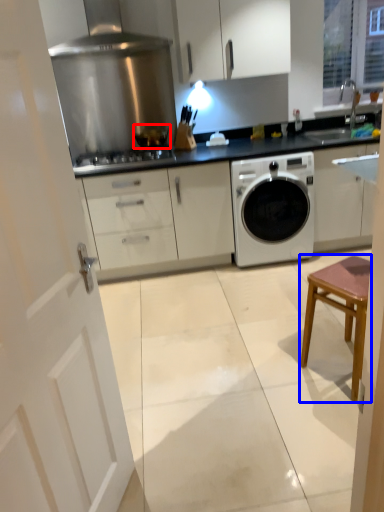
Question: Which object appears closest to the camera in this image, kitchen appliance (highlighted by a red box) or stool (highlighted by a blue box)?

Choices:
 (A) kitchen appliance
 (B) stool

Answer: (B)